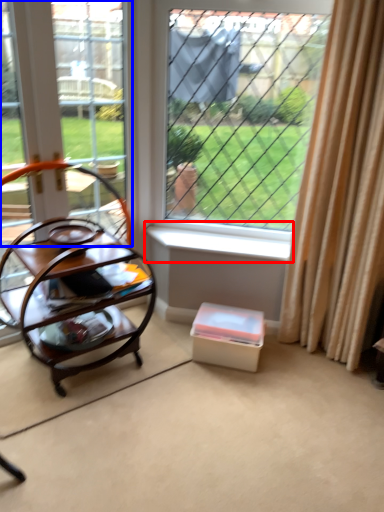
Question: Which object is further to the camera taking this photo, window sill (highlighted by a red box) or window frame (highlighted by a blue box)?

Choices:
 (A) window sill
 (B) window frame

Answer: (A)